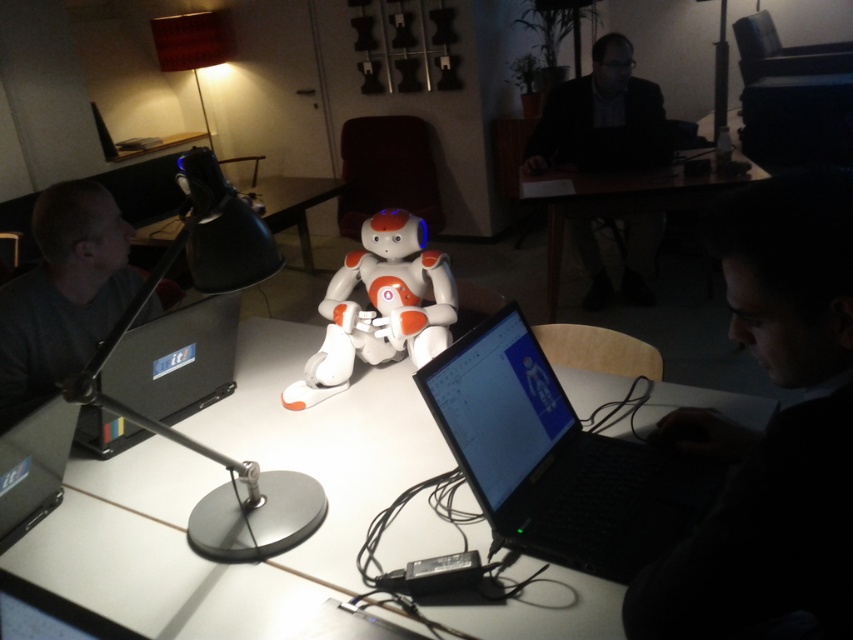
You are standing in the office and need to place a document on the table closest to the robot. Which table should you use, the white plastic table at center or the black plastic table at center?

The white plastic table at center is to the right of the black plastic table at center, so the black plastic table at center is closer to the robot. Place the document on the black plastic table at center.

You are a delivery person who just arrived at the office. You need to place a package on the wooden table at center. However, there is a black matte laptop at lower right on the table. Can you place the package there without moving the laptop?

The black matte laptop at lower right is in front of wooden table at center, meaning it is placed on the table. Since the laptop is already on the wooden table at center, you can place the package on the remaining space of the wooden table at center as long as there is enough room.

You are organizing a presentation and need to place a projector on the surface that can support it. Based on the scene, which object between the black matte laptop at lower right and the wooden table at center should you choose?

The wooden table at center is taller than the black matte laptop at lower right, so the wooden table at center would be the appropriate surface to place the projector since it is higher and likely more stable.